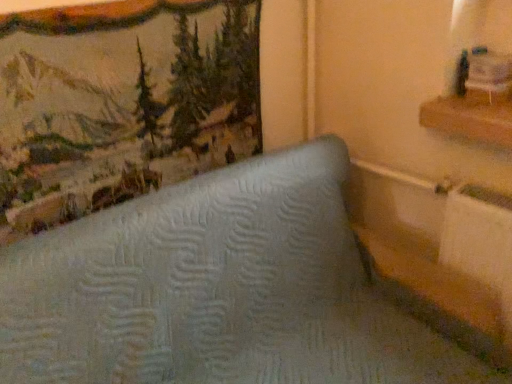
In order to click on vacant space situated above textured fabric picture frame at upper left (from a real-world perspective) in this screenshot , I will do `click(71, 5)`.